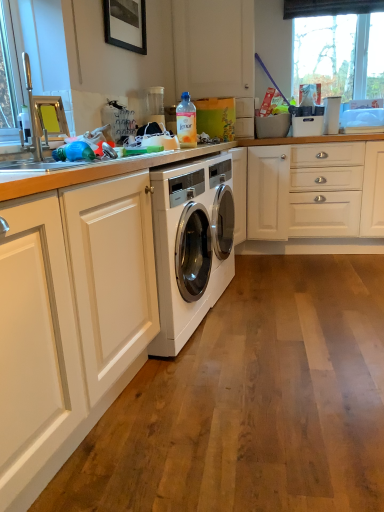
Find the location of a particular element. The width and height of the screenshot is (384, 512). spots to the right of white glossy washing machine at center is located at coordinates click(276, 281).